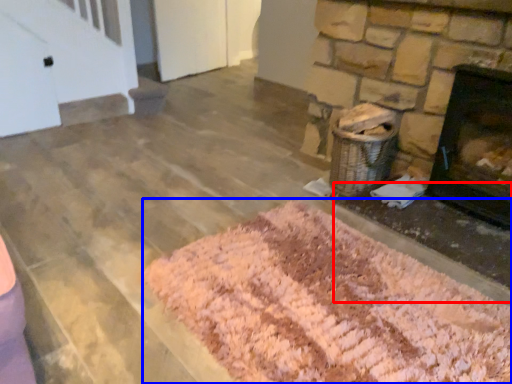
Question: Which of the following is the farthest to the observer, foundation (highlighted by a red box) or mat (highlighted by a blue box)?

Choices:
 (A) foundation
 (B) mat

Answer: (A)